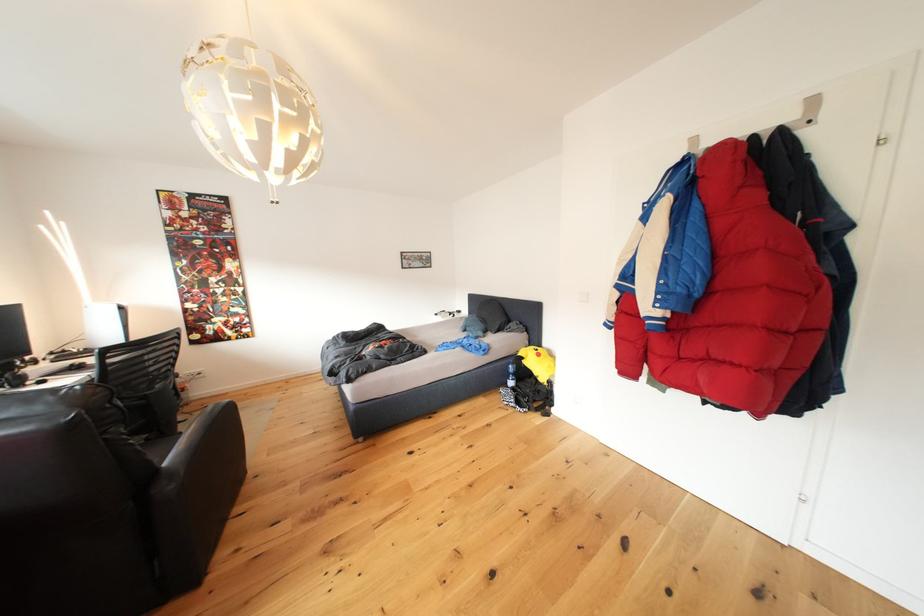
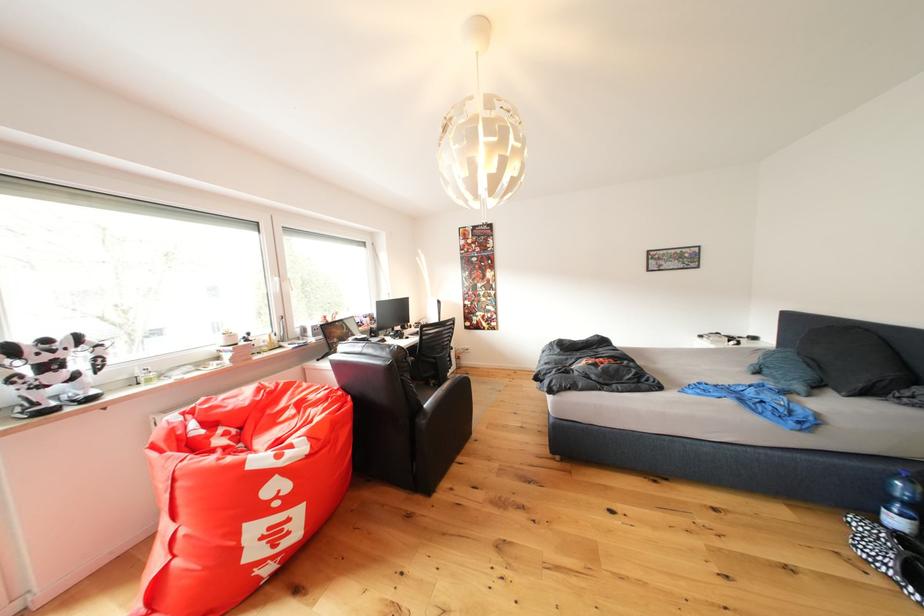
Locate, in the second image, the point that corresponds to point 174,469 in the first image.

(434, 410)